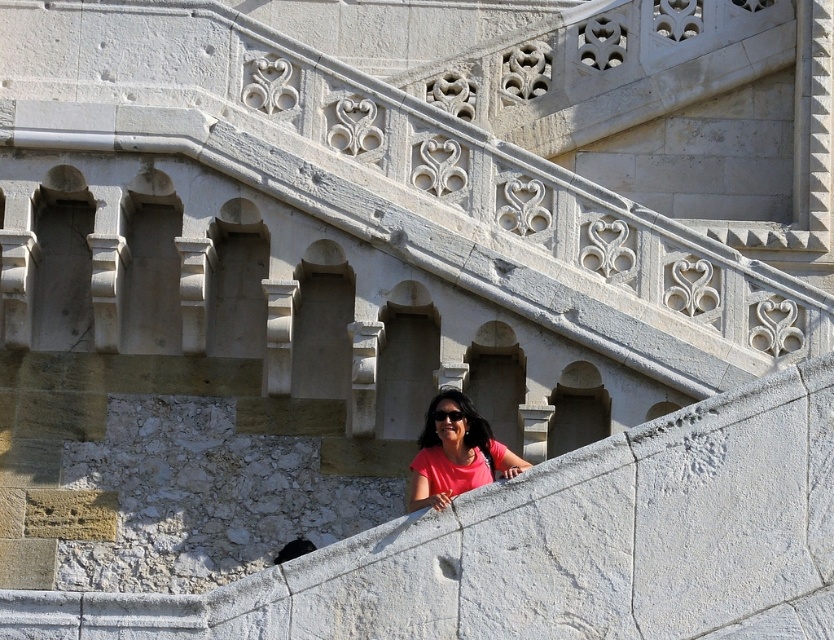
You are an interior designer assessing the placement of the pink matte shirt at center in the grand stone staircase. Considering the symmetry of the staircase with its arched recesses and decorative band, is the shirt positioned centrally along the horizontal axis of the staircase?

The pink matte shirt at center is located at point [456,454]. Since the staircase has symmetric arched recesses, the central horizontal axis would be at x coordinate 0.5. The shirt is at x 0.711 which is to the right of center, so it is not positioned centrally along the horizontal axis.

You are an interior designer observing the staircase scene. You notice the pink matte shirt at center and the black plastic goggles at center. Which object is positioned more to the left side of the scene?

The black plastic goggles at center are positioned more to the left side of the scene because the pink matte shirt at center is to the right of them.

Consider the image. You are an interior designer assessing the staircase for safety. You notice the pink matte shirt at center and the black plastic goggles at center. Which object is taller when viewed from the bottom of the staircase?

The pink matte shirt at center is taller than the black plastic goggles at center.